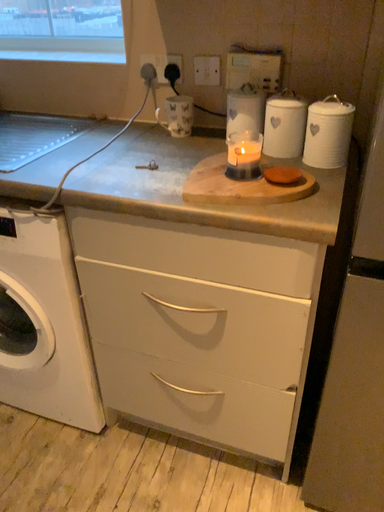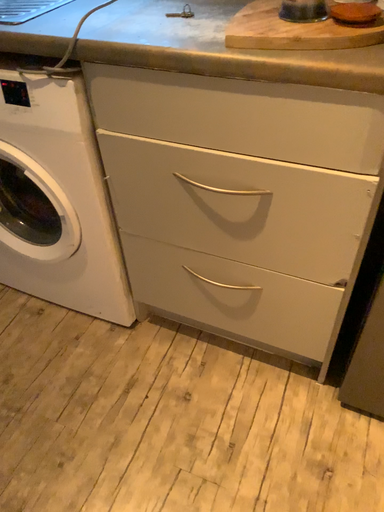
Question: Which way did the camera rotate in the video?

Choices:
 (A) rotated downward
 (B) rotated upward

Answer: (A)